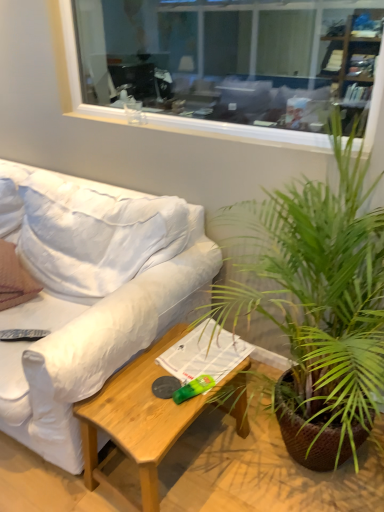
Question: Does clear glass window at upper center lie in front of brown textured pillow at left?

Choices:
 (A) yes
 (B) no

Answer: (A)

Question: Considering the relative sizes of clear glass window at upper center and brown textured pillow at left in the image provided, is clear glass window at upper center smaller than brown textured pillow at left?

Choices:
 (A) yes
 (B) no

Answer: (B)

Question: Is clear glass window at upper center positioned with its back to brown textured pillow at left?

Choices:
 (A) yes
 (B) no

Answer: (B)

Question: From the image's perspective, is clear glass window at upper center below brown textured pillow at left?

Choices:
 (A) no
 (B) yes

Answer: (A)

Question: Is clear glass window at upper center to the left of brown textured pillow at left from the viewer's perspective?

Choices:
 (A) yes
 (B) no

Answer: (B)

Question: Is clear glass window at upper center far away from brown textured pillow at left?

Choices:
 (A) yes
 (B) no

Answer: (A)

Question: From a real-world perspective, is light brown wood coffee table at lower center below brown textured pillow at left?

Choices:
 (A) no
 (B) yes

Answer: (B)

Question: Considering the relative sizes of light brown wood coffee table at lower center and brown textured pillow at left in the image provided, is light brown wood coffee table at lower center thinner than brown textured pillow at left?

Choices:
 (A) yes
 (B) no

Answer: (B)

Question: Is light brown wood coffee table at lower center wider than brown textured pillow at left?

Choices:
 (A) no
 (B) yes

Answer: (B)

Question: From a real-world perspective, does light brown wood coffee table at lower center stand above brown textured pillow at left?

Choices:
 (A) no
 (B) yes

Answer: (A)

Question: Is light brown wood coffee table at lower center in front of brown textured pillow at left?

Choices:
 (A) yes
 (B) no

Answer: (A)

Question: Is light brown wood coffee table at lower center bigger than brown textured pillow at left?

Choices:
 (A) no
 (B) yes

Answer: (B)

Question: Considering the relative positions of light brown wood coffee table at lower center and white fabric couch at left in the image provided, is light brown wood coffee table at lower center to the left of white fabric couch at left from the viewer's perspective?

Choices:
 (A) yes
 (B) no

Answer: (B)